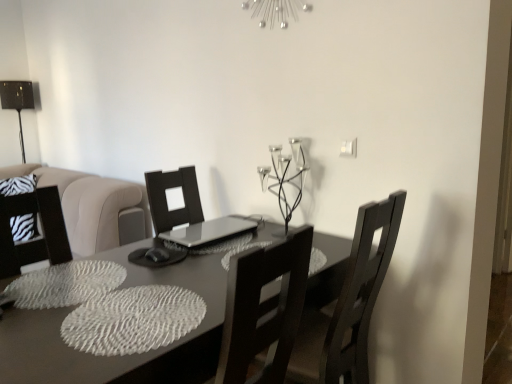
Question: Is the depth of metallic black table lamp at left greater than that of dark wood chair at center?

Choices:
 (A) no
 (B) yes

Answer: (B)

Question: From the image's perspective, is metallic black table lamp at left located beneath dark wood chair at center?

Choices:
 (A) yes
 (B) no

Answer: (B)

Question: Considering the relative positions of metallic black table lamp at left and dark wood chair at center in the image provided, is metallic black table lamp at left in front of dark wood chair at center?

Choices:
 (A) yes
 (B) no

Answer: (B)

Question: From a real-world perspective, is metallic black table lamp at left physically below dark wood chair at center?

Choices:
 (A) yes
 (B) no

Answer: (B)

Question: Is metallic black table lamp at left smaller than dark wood chair at center?

Choices:
 (A) no
 (B) yes

Answer: (B)

Question: Considering the positions of point (273, 145) and point (15, 104), is point (273, 145) closer or farther from the camera than point (15, 104)?

Choices:
 (A) closer
 (B) farther

Answer: (A)

Question: In the image, is metallic black candle holder at upper center on the left side or the right side of metallic black table lamp at left?

Choices:
 (A) right
 (B) left

Answer: (A)

Question: From a real-world perspective, relative to metallic black table lamp at left, is metallic black candle holder at upper center vertically above or below?

Choices:
 (A) above
 (B) below

Answer: (B)

Question: In terms of size, does metallic black candle holder at upper center appear bigger or smaller than metallic black table lamp at left?

Choices:
 (A) small
 (B) big

Answer: (A)

Question: Is metallic black table lamp at left spatially inside matte gray table at center, or outside of it?

Choices:
 (A) outside
 (B) inside

Answer: (A)

Question: Based on their sizes in the image, would you say metallic black table lamp at left is bigger or smaller than matte gray table at center?

Choices:
 (A) small
 (B) big

Answer: (A)

Question: In the image, is metallic black table lamp at left positioned in front of or behind matte gray table at center?

Choices:
 (A) behind
 (B) front

Answer: (A)

Question: In terms of height, does metallic black table lamp at left look taller or shorter compared to matte gray table at center?

Choices:
 (A) tall
 (B) short

Answer: (B)

Question: Is dark wood chair at center taller or shorter than metallic black candle holder at upper center?

Choices:
 (A) tall
 (B) short

Answer: (A)

Question: Is point [x=314, y=322] closer or farther from the camera than point [x=302, y=147]?

Choices:
 (A) farther
 (B) closer

Answer: (B)